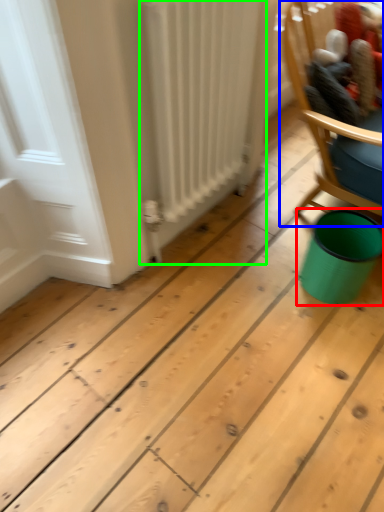
Question: Which object is the closest to the teal (highlighted by a red box)? Choose among these: chair (highlighted by a blue box) or radiator (highlighted by a green box).

Choices:
 (A) chair
 (B) radiator

Answer: (A)